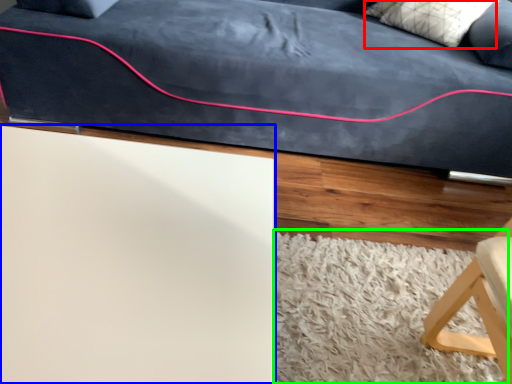
Question: Which is nearer to the pillow (highlighted by a red box)? table (highlighted by a blue box) or mat (highlighted by a green box).

Choices:
 (A) table
 (B) mat

Answer: (B)